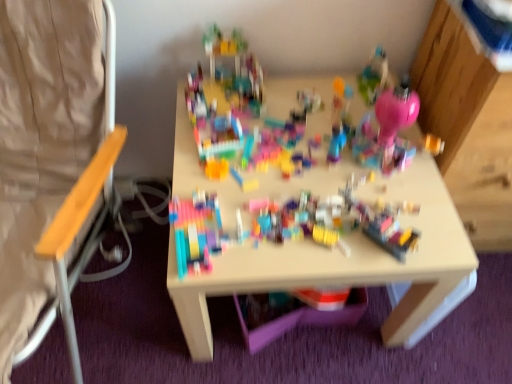
Question: Is the position of wooden seat at left more distant than that of multicolored plastic blocks at center, the 2th toy positioned from the right?

Choices:
 (A) no
 (B) yes

Answer: (A)

Question: Considering the relative positions of wooden seat at left and multicolored plastic blocks at center, the 1th toy positioned from the top, in the image provided, is wooden seat at left to the left of multicolored plastic blocks at center, the 1th toy positioned from the top, from the viewer's perspective?

Choices:
 (A) no
 (B) yes

Answer: (B)

Question: Does wooden seat at left have a lesser width compared to multicolored plastic blocks at center, the 2th toy positioned from the right?

Choices:
 (A) yes
 (B) no

Answer: (B)

Question: Does wooden seat at left touch multicolored plastic blocks at center, which is the 2th toy in back-to-front order?

Choices:
 (A) yes
 (B) no

Answer: (B)

Question: From a real-world perspective, is wooden seat at left beneath multicolored plastic blocks at center, the 1th toy positioned from the top?

Choices:
 (A) yes
 (B) no

Answer: (B)

Question: Looking at their shapes, would you say wooden seat at left is wider or thinner than multicolored plastic blocks at center, the 1th toy positioned from the top?

Choices:
 (A) wide
 (B) thin

Answer: (A)

Question: Visually, is wooden seat at left positioned to the left or to the right of multicolored plastic blocks at center, which is the 2th toy from bottom to top?

Choices:
 (A) right
 (B) left

Answer: (B)

Question: From the image's perspective, is wooden seat at left positioned above or below multicolored plastic blocks at center, which is the 2th toy in back-to-front order?

Choices:
 (A) above
 (B) below

Answer: (A)

Question: From their relative heights in the image, would you say wooden seat at left is taller or shorter than multicolored plastic blocks at center, the 1th toy positioned from the top?

Choices:
 (A) short
 (B) tall

Answer: (B)

Question: From a real-world perspective, is translucent plastic container at center, which is the 2th toy in top-to-bottom order, above or below wooden seat at left?

Choices:
 (A) below
 (B) above

Answer: (B)

Question: Does point (359, 211) appear closer or farther from the camera than point (23, 225)?

Choices:
 (A) closer
 (B) farther

Answer: (A)

Question: Is translucent plastic container at center, the first toy when ordered from bottom to top, inside or outside of wooden seat at left?

Choices:
 (A) outside
 (B) inside

Answer: (A)

Question: In the image, is translucent plastic container at center, which appears as the second toy when viewed from the left, on the left side or the right side of wooden seat at left?

Choices:
 (A) left
 (B) right

Answer: (B)

Question: From a real-world perspective, is translucent plastic container at center, the 2th toy in the front-to-back sequence, positioned above or below multicolored plastic blocks at center, which is counted as the 1th toy, starting from the front?

Choices:
 (A) above
 (B) below

Answer: (A)

Question: Does point (403, 258) appear closer or farther from the camera than point (324, 114)?

Choices:
 (A) closer
 (B) farther

Answer: (A)